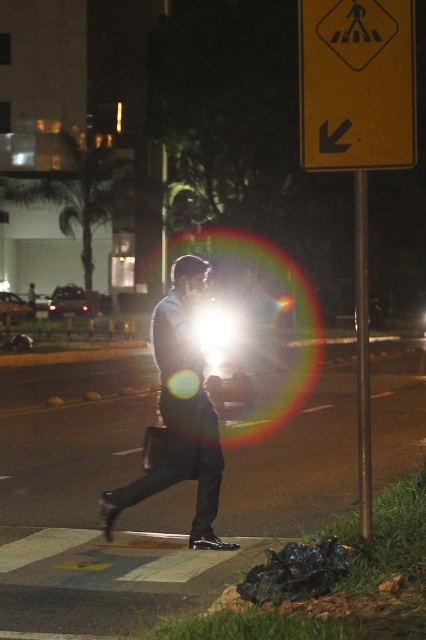
Question: Does light blue shirt at center have a lesser width compared to metallic pole at right?

Choices:
 (A) no
 (B) yes

Answer: (B)

Question: Does light blue shirt at center have a greater width compared to metallic pole at right?

Choices:
 (A) no
 (B) yes

Answer: (A)

Question: Among these objects, which one is farthest from the camera?

Choices:
 (A) metallic pole at right
 (B) yellow plastic traffic sign at upper right
 (C) light blue shirt at center

Answer: (C)

Question: Which object is closer to the camera taking this photo?

Choices:
 (A) light blue shirt at center
 (B) metallic pole at right

Answer: (B)

Question: Where is yellow plastic traffic sign at upper right located in relation to metallic pole at right in the image?

Choices:
 (A) below
 (B) above

Answer: (A)

Question: Which object is positioned closest to the metallic pole at right?

Choices:
 (A) yellow plastic traffic sign at upper right
 (B) light blue shirt at center

Answer: (B)